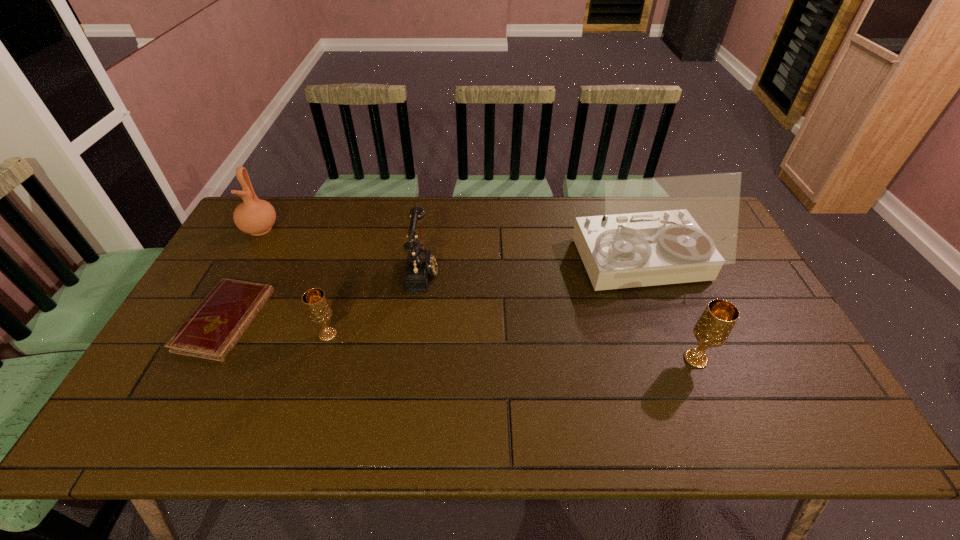
The width and height of the screenshot is (960, 540). I want to click on empty space between the telephone and the pottery, so click(342, 249).

The height and width of the screenshot is (540, 960). What are the coordinates of `free point between the record player and the third object from right to left` in the screenshot? It's located at (532, 267).

You are a GUI agent. You are given a task and a screenshot of the screen. Output one action in this format:
    pyautogui.click(x=<x>, y=<y>)
    Task: Click on the free space between the tallest object and the shorter chalice
    This screenshot has height=540, width=960.
    Given the screenshot: What is the action you would take?
    pyautogui.click(x=485, y=299)

What are the coordinates of `blank region between the right chalice and the tallest object` in the screenshot? It's located at (668, 311).

Select which object is the fourth closest to the shortest object. Please provide its 2D coordinates. Your answer should be formatted as a tuple, i.e. [(x, y)], where the tuple contains the x and y coordinates of a point satisfying the conditions above.

[(665, 230)]

Where is `object that can be found as the third closest to the pottery`? The width and height of the screenshot is (960, 540). object that can be found as the third closest to the pottery is located at coordinates (420, 264).

Identify the location of free space that satisfies the following two spatial constraints: 1. on the spout of the nearer chalice; 2. on the left side of the pottery. The height and width of the screenshot is (540, 960). [x=188, y=359].

The image size is (960, 540). I want to click on free spot that satisfies the following two spatial constraints: 1. on the back side of the right chalice; 2. on the dial of the telephone, so click(x=660, y=271).

Identify the location of free spot that satisfies the following two spatial constraints: 1. on the spout of the pottery; 2. on the right side of the notebook. (209, 320).

Image resolution: width=960 pixels, height=540 pixels. What are the coordinates of `free region that satisfies the following two spatial constraints: 1. on the spout of the tallest object; 2. on the right side of the pottery` in the screenshot? It's located at pos(241,264).